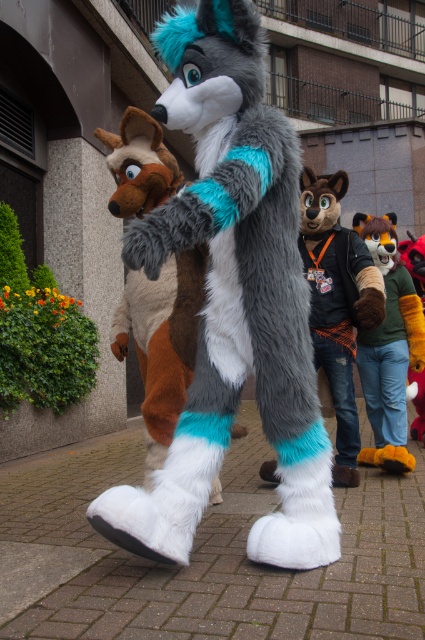
Question: In this image, where is fluffy fur suit at center located relative to green fuzzy sweater at right?

Choices:
 (A) above
 (B) below

Answer: (B)

Question: Which point is closer to the camera?

Choices:
 (A) fluffy fur suit at center
 (B) fluffy fur coat at center

Answer: (A)

Question: Which point is farther to the camera?

Choices:
 (A) fluffy fur suit at center
 (B) fluffy fur coat at center

Answer: (B)

Question: Can you confirm if fluffy fur suit at center is wider than green fuzzy sweater at right?

Choices:
 (A) yes
 (B) no

Answer: (A)

Question: Which object is the farthest from the fluffy fur wolf at center?

Choices:
 (A) green fuzzy sweater at right
 (B) fluffy fur coat at center
 (C) fluffy fur suit at center

Answer: (A)

Question: Is fluffy fur suit at center below fluffy fur coat at center?

Choices:
 (A) no
 (B) yes

Answer: (B)